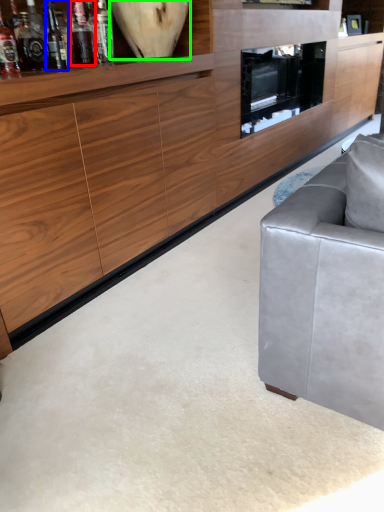
Question: Which object is positioned closest to bottle (highlighted by a red box)? Select from wine bottle (highlighted by a blue box) and vase (highlighted by a green box).

Choices:
 (A) wine bottle
 (B) vase

Answer: (A)